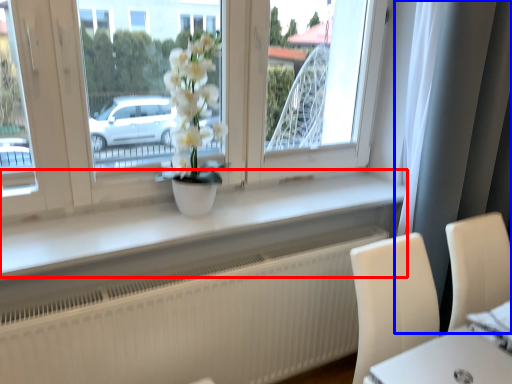
Question: Which object is closer to the camera taking this photo, window sill (highlighted by a red box) or curtain (highlighted by a blue box)?

Choices:
 (A) window sill
 (B) curtain

Answer: (A)